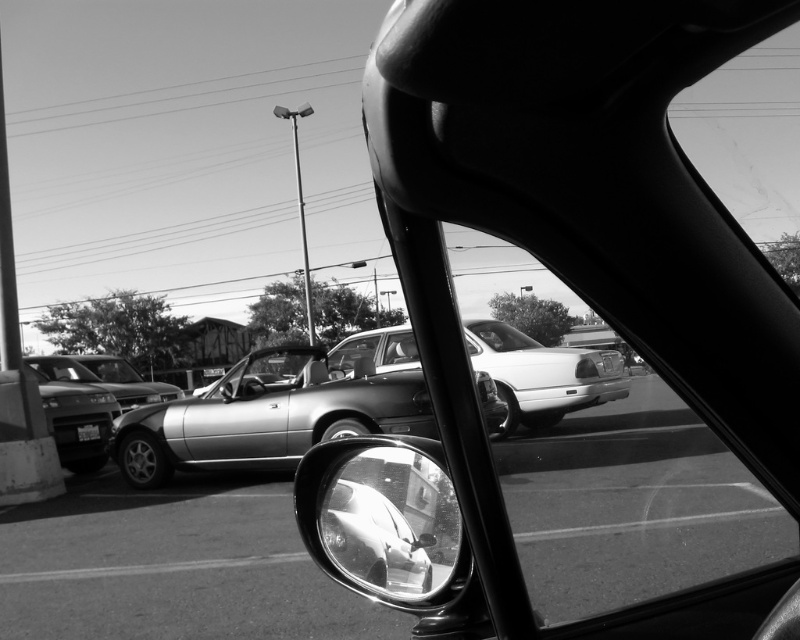
Question: Does shiny chrome mirror at lower center appear on the left side of shiny silver convertible at center?

Choices:
 (A) yes
 (B) no

Answer: (B)

Question: Which point is closer to the camera taking this photo?

Choices:
 (A) (336, 480)
 (B) (98, 442)

Answer: (A)

Question: Does shiny metallic convertible at center appear on the right side of shiny silver convertible at center?

Choices:
 (A) yes
 (B) no

Answer: (A)

Question: Which object is farther from the camera taking this photo?

Choices:
 (A) shiny chrome mirror at lower center
 (B) shiny silver sedan at left
 (C) shiny silver convertible at center
 (D) shiny metallic convertible at center

Answer: (C)

Question: Is shiny silver sedan at left below shiny silver convertible at center?

Choices:
 (A) no
 (B) yes

Answer: (B)

Question: Which is farther from the shiny chrome mirror at lower center?

Choices:
 (A) shiny silver sedan at left
 (B) shiny metallic convertible at center

Answer: (A)